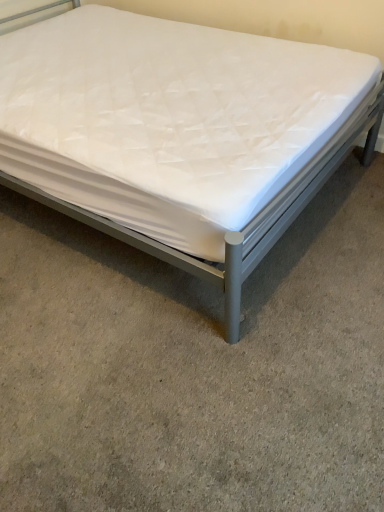
This screenshot has height=512, width=384. Describe the element at coordinates (179, 133) in the screenshot. I see `white quilted mattress at center` at that location.

I want to click on white quilted mattress at center, so click(179, 133).

In order to face white quilted mattress at center, should I rotate leftwards or rightwards?

You should rotate left by 8.563 degrees.

Image resolution: width=384 pixels, height=512 pixels. What do you see at coordinates (194, 366) in the screenshot? I see `white quilted mattress at center` at bounding box center [194, 366].

Locate an element on the screen. This screenshot has width=384, height=512. white quilted mattress at center is located at coordinates (194, 366).

Locate an element on the screen. The image size is (384, 512). white quilted mattress at center is located at coordinates (179, 133).

Based on their positions, is white quilted mattress at center located to the left or right of white quilted mattress at center?

In the image, white quilted mattress at center appears on the right side of white quilted mattress at center.

Does white quilted mattress at center come behind white quilted mattress at center?

No, it is not.

Which is closer, (160, 500) or (357, 124)?

Point (160, 500) appears to be closer to the viewer than point (357, 124).

From the image's perspective, is white quilted mattress at center below white quilted mattress at center?

Yes, from the image's perspective, white quilted mattress at center is beneath white quilted mattress at center.

From a real-world perspective, which object rests below the other?

white quilted mattress at center, from a real-world perspective.

Can you confirm if white quilted mattress at center is wider than white quilted mattress at center?

Indeed, white quilted mattress at center has a greater width compared to white quilted mattress at center.

Considering the sizes of objects white quilted mattress at center and white quilted mattress at center in the image provided, who is shorter, white quilted mattress at center or white quilted mattress at center?

white quilted mattress at center is shorter.

Is white quilted mattress at center bigger or smaller than white quilted mattress at center?

Clearly, white quilted mattress at center is smaller in size than white quilted mattress at center.

Is white quilted mattress at center inside white quilted mattress at center?

No, white quilted mattress at center is not surrounded by white quilted mattress at center.

Is white quilted mattress at center next to white quilted mattress at center?

No, white quilted mattress at center is not beside white quilted mattress at center.

Is white quilted mattress at center facing towards white quilted mattress at center?

No, white quilted mattress at center is not aimed at white quilted mattress at center.

Can you tell me how much white quilted mattress at center and white quilted mattress at center differ in facing direction?

white quilted mattress at center and white quilted mattress at center are facing 91.2 degrees away from each other.

Where is `bed behind the white quilted mattress at center`? Image resolution: width=384 pixels, height=512 pixels. bed behind the white quilted mattress at center is located at coordinates (179, 133).

Based on the photo, can you confirm if white quilted mattress at center is positioned to the right of white quilted mattress at center?

No.

Is the position of white quilted mattress at center more distant than that of white quilted mattress at center?

Yes, white quilted mattress at center is behind white quilted mattress at center.

Which point is more forward, [140,244] or [373,382]?

The point [373,382] is closer to the camera.

From the image's perspective, between white quilted mattress at center and white quilted mattress at center, which one is located above?

white quilted mattress at center is shown above in the image.

From a real-world perspective, who is located lower, white quilted mattress at center or white quilted mattress at center?

From a 3D spatial view, white quilted mattress at center is below.

Does white quilted mattress at center have a lesser width compared to white quilted mattress at center?

Yes, white quilted mattress at center is thinner than white quilted mattress at center.

From the picture: Which of these two, white quilted mattress at center or white quilted mattress at center, stands shorter?

With less height is white quilted mattress at center.

Is white quilted mattress at center bigger or smaller than white quilted mattress at center?

In the image, white quilted mattress at center appears to be larger than white quilted mattress at center.

Is white quilted mattress at center situated inside white quilted mattress at center or outside?

white quilted mattress at center lies outside white quilted mattress at center.

Is white quilted mattress at center next to white quilted mattress at center and touching it?

No, white quilted mattress at center is not with white quilted mattress at center.

Could you tell me if white quilted mattress at center is facing white quilted mattress at center?

No, white quilted mattress at center is not oriented towards white quilted mattress at center.

Identify the location of bed above the white quilted mattress at center (from the image's perspective). (179, 133).

Where is `concrete lying in front of the white quilted mattress at center`? The width and height of the screenshot is (384, 512). concrete lying in front of the white quilted mattress at center is located at coordinates (194, 366).

At what (x,y) coordinates should I click in order to perform the action: click on bed on the left of white quilted mattress at center. Please return your answer as a coordinate pair (x, y). The image size is (384, 512). Looking at the image, I should click on (179, 133).